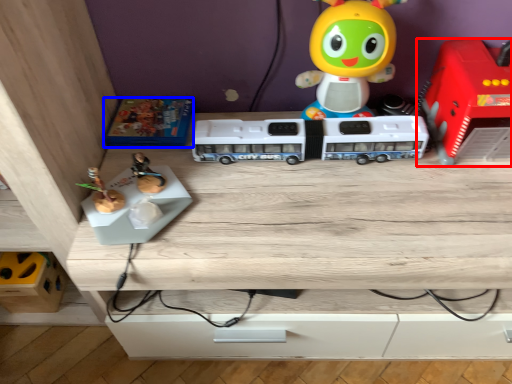
Question: Which of the following is the closest to the observer, toy (highlighted by a red box) or toy (highlighted by a blue box)?

Choices:
 (A) toy
 (B) toy

Answer: (A)